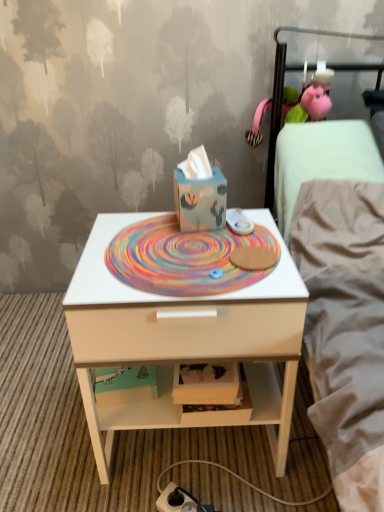
Question: From a real-world perspective, is multicolored woven mat at center physically located above or below matte blue cardboard box at center?

Choices:
 (A) above
 (B) below

Answer: (B)

Question: From the image's perspective, relative to matte blue cardboard box at center, is multicolored woven mat at center above or below?

Choices:
 (A) below
 (B) above

Answer: (A)

Question: Which object is positioned farthest from the matte blue cardboard box at center?

Choices:
 (A) white matte nightstand at center
 (B) white plastic charger at lower center
 (C) multicolored woven mat at center
 (D) white fabric bed at upper right

Answer: (B)

Question: Which of these objects is positioned closest to the white fabric bed at upper right?

Choices:
 (A) white plastic charger at lower center
 (B) matte blue cardboard box at center
 (C) white matte nightstand at center
 (D) multicolored woven mat at center

Answer: (B)